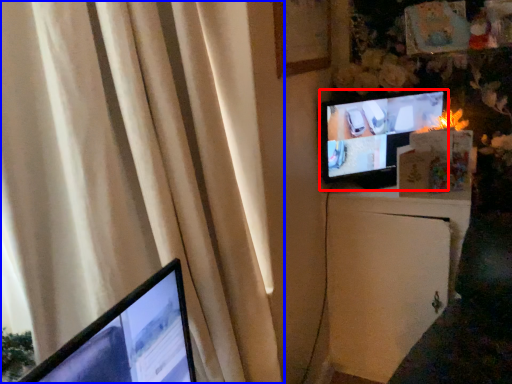
Question: Which point is closer to the camera, television (highlighted by a red box) or curtain (highlighted by a blue box)?

Choices:
 (A) television
 (B) curtain

Answer: (B)